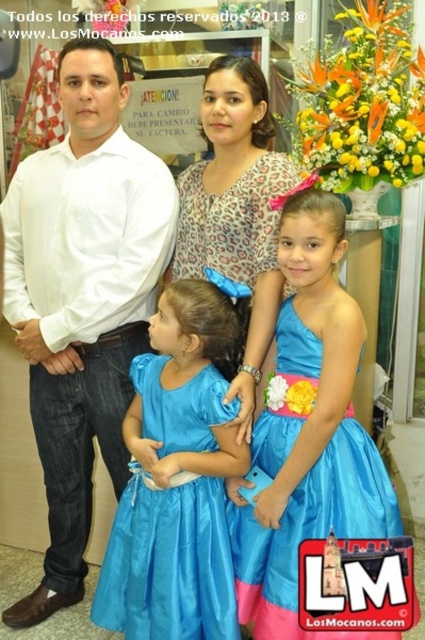
Who is positioned more to the left, white shirt at left or blue satin dress at center?

Positioned to the left is white shirt at left.

Based on the photo, between white shirt at left and blue satin dress at center, which one appears on the right side from the viewer's perspective?

From the viewer's perspective, blue satin dress at center appears more on the right side.

Who is more distant from viewer, (90,460) or (254,602)?

Point (90,460)

This screenshot has width=425, height=640. What are the coordinates of `white shirt at left` in the screenshot? It's located at (82, 300).

Which is more to the left, matte blue dress at center or blue satin dress at center?

Positioned to the left is matte blue dress at center.

Can you confirm if matte blue dress at center is wider than blue satin dress at center?

No.

Find the location of a particular element. The width and height of the screenshot is (425, 640). matte blue dress at center is located at coordinates (167, 563).

At what (x,y) coordinates should I click in order to perform the action: click on matte blue dress at center. Please return your answer as a coordinate pair (x, y). This screenshot has height=640, width=425. Looking at the image, I should click on (167, 563).

Is point (189, 541) positioned behind point (252, 337)?

No, (189, 541) is closer to viewer.

Find the location of a particular element. matte blue dress at center is located at coordinates (167, 563).